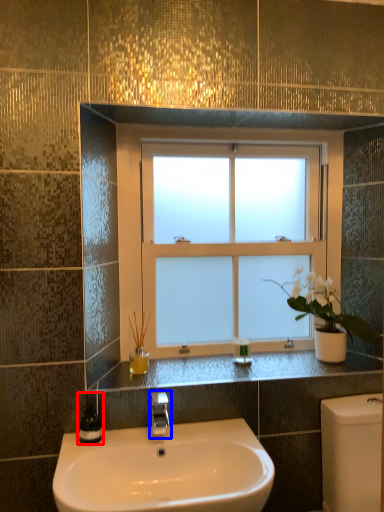
Question: Which of the following is the farthest to the observer, soap dispenser (highlighted by a red box) or tap (highlighted by a blue box)?

Choices:
 (A) soap dispenser
 (B) tap

Answer: (A)